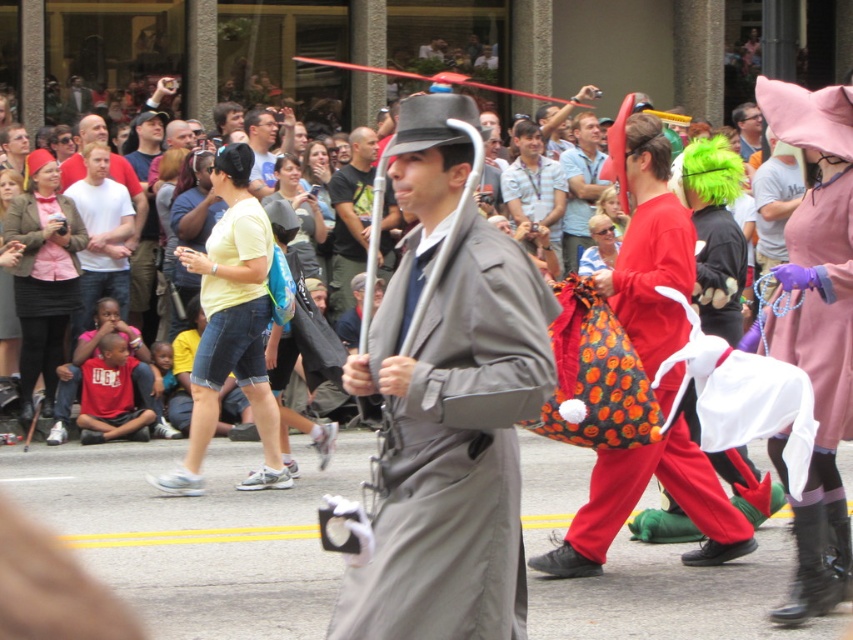
You are a participant in the parade and you want to hand over an item to the person holding the orange fabric bag at center and the matte black hat at center. Which object should you approach first to ensure you give the item to the correct person?

The orange fabric bag at center is positioned on the right side of matte black hat at center, so you should approach the matte black hat at center first as it is on the left side and closer to your current position.

You are organizing a street performance and need to decide which item to place on a narrow shelf. The shelf can only hold items up to the width of the matte black hat at center. Do you think the orange fabric bag at center will fit on the shelf?

The orange fabric bag at center is wider than the matte black hat at center, so it will not fit on the shelf designed for items up to the width of the matte black hat at center.

You are a spectator at the event and want to locate the matte gray coat at center and the orange fabric bag at center. Which one is positioned to the left?

The matte gray coat at center is to the left of orange fabric bag at center.